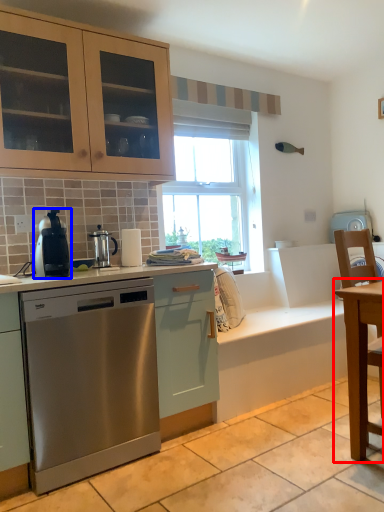
Question: Which object appears closest to the camera in this image, table (highlighted by a red box) or home appliance (highlighted by a blue box)?

Choices:
 (A) table
 (B) home appliance

Answer: (A)